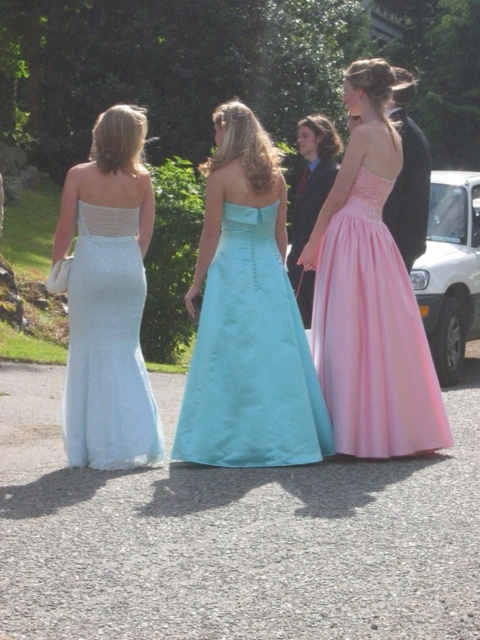
Is matte satin dress at center below light blue satin dress at center?

Incorrect, matte satin dress at center is not positioned below light blue satin dress at center.

Does matte satin dress at center appear on the left side of light blue satin dress at center?

No, matte satin dress at center is not to the left of light blue satin dress at center.

Locate an element on the screen. The image size is (480, 640). matte satin dress at center is located at coordinates (370, 296).

Is matte satin dress at center smaller than pink satin dress at center?

No, matte satin dress at center is not smaller than pink satin dress at center.

Between point (308, 360) and point (362, 179), which one is positioned behind?

The point (362, 179) is behind.

The image size is (480, 640). What do you see at coordinates (370, 296) in the screenshot? I see `matte satin dress at center` at bounding box center [370, 296].

Identify the location of matte satin dress at center. (370, 296).

This screenshot has height=640, width=480. What do you see at coordinates (372, 336) in the screenshot? I see `pink satin dress at center` at bounding box center [372, 336].

Can you confirm if pink satin dress at center is wider than satin white dress at center?

Yes, pink satin dress at center is wider than satin white dress at center.

Between point (312, 353) and point (79, 305), which one is positioned in front?

Point (79, 305)

Where is `pink satin dress at center`? The height and width of the screenshot is (640, 480). pink satin dress at center is located at coordinates (372, 336).